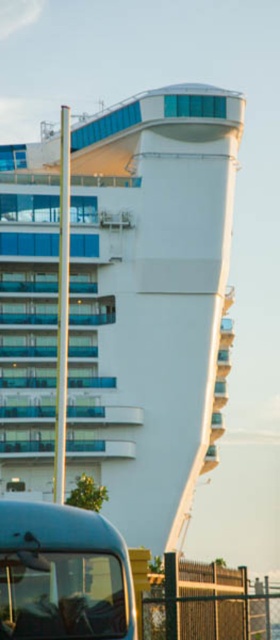
Is white glossy cruise ship at center behind metallic blue tour bus at lower left?

Yes.

Find the location of a particular element. The width and height of the screenshot is (280, 640). white glossy cruise ship at center is located at coordinates (150, 301).

At what (x,y) coordinates should I click in order to perform the action: click on white glossy cruise ship at center. Please return your answer as a coordinate pair (x, y). This screenshot has height=640, width=280. Looking at the image, I should click on (150, 301).